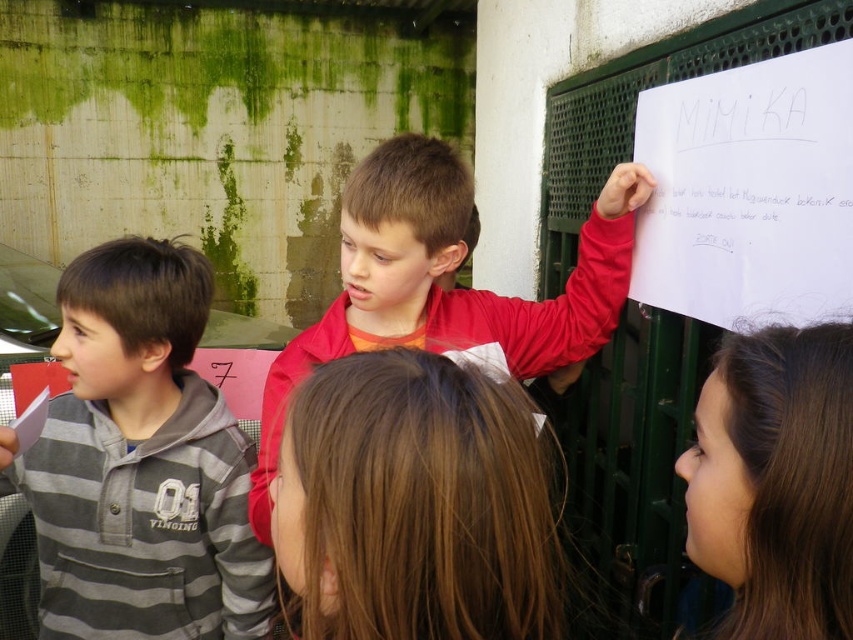
Question: Does gray striped hoodie at left lie in front of brown hair at upper right?

Choices:
 (A) no
 (B) yes

Answer: (A)

Question: Can you confirm if brown hair at center is positioned to the left of brown hair at upper right?

Choices:
 (A) yes
 (B) no

Answer: (A)

Question: Based on their relative distances, which object is nearer to the gray striped hoodie at left?

Choices:
 (A) brown hair at upper right
 (B) brown hair at center

Answer: (B)

Question: Which object is the farthest from the brown hair at upper right?

Choices:
 (A) red matte jacket at center
 (B) gray striped hoodie at left
 (C) brown hair at center

Answer: (B)

Question: Which object is farther from the camera taking this photo?

Choices:
 (A) brown hair at upper right
 (B) red matte jacket at center

Answer: (B)

Question: Is red matte jacket at center thinner than brown hair at upper right?

Choices:
 (A) no
 (B) yes

Answer: (A)